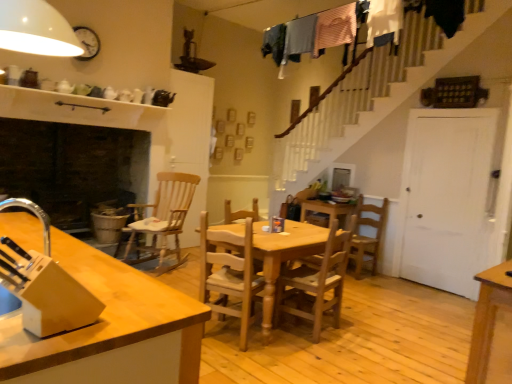
Question: Can you confirm if wooden rocking chair at center-left, positioned as the third chair in front-to-back order, is taller than wooden table at center?

Choices:
 (A) yes
 (B) no

Answer: (A)

Question: From the image's perspective, is wooden rocking chair at center-left, which is counted as the 1th chair, starting from the left, below wooden table at center?

Choices:
 (A) no
 (B) yes

Answer: (A)

Question: Does wooden rocking chair at center-left, positioned as the third chair in front-to-back order, have a lesser height compared to wooden table at center?

Choices:
 (A) yes
 (B) no

Answer: (B)

Question: Considering the relative sizes of wooden rocking chair at center-left, positioned as the third chair in front-to-back order, and wooden table at center in the image provided, is wooden rocking chair at center-left, positioned as the third chair in front-to-back order, wider than wooden table at center?

Choices:
 (A) no
 (B) yes

Answer: (A)

Question: From a real-world perspective, is wooden rocking chair at center-left, which is counted as the 1th chair, starting from the left, located beneath wooden table at center?

Choices:
 (A) no
 (B) yes

Answer: (A)

Question: Considering the positions of light brown wooden chair at center, which is counted as the 1th chair, starting from the front, and wooden table at center in the image, is light brown wooden chair at center, which is counted as the 1th chair, starting from the front, taller or shorter than wooden table at center?

Choices:
 (A) tall
 (B) short

Answer: (A)

Question: From the image's perspective, is light brown wooden chair at center, marked as the 3th chair in a right-to-left arrangement, positioned above or below wooden table at center?

Choices:
 (A) above
 (B) below

Answer: (A)

Question: Is light brown wooden chair at center, the 4th chair positioned from the back, inside or outside of wooden table at center?

Choices:
 (A) inside
 (B) outside

Answer: (A)

Question: Is light brown wooden chair at center, the 2th chair positioned from the left, wider or thinner than wooden table at center?

Choices:
 (A) wide
 (B) thin

Answer: (B)

Question: Based on their positions, is light brown wood at left located to the left or right of wooden table at center?

Choices:
 (A) right
 (B) left

Answer: (B)

Question: Relative to wooden table at center, is light brown wood at left in front or behind?

Choices:
 (A) behind
 (B) front

Answer: (B)

Question: Is light brown wood at left bigger or smaller than wooden table at center?

Choices:
 (A) small
 (B) big

Answer: (B)

Question: In terms of height, does light brown wood at left look taller or shorter compared to wooden table at center?

Choices:
 (A) short
 (B) tall

Answer: (B)

Question: Does point (202, 286) appear closer or farther from the camera than point (156, 337)?

Choices:
 (A) farther
 (B) closer

Answer: (A)

Question: In the image, is light brown wooden chair at center, marked as the 3th chair in a right-to-left arrangement, positioned in front of or behind light brown wood at left?

Choices:
 (A) front
 (B) behind

Answer: (B)